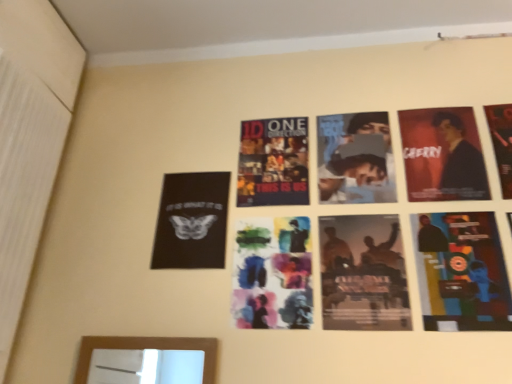
Question: Is point (240, 274) closer or farther from the camera than point (467, 155)?

Choices:
 (A) closer
 (B) farther

Answer: (A)

Question: Considering the positions of watercolor paper poster at center, placed as the second poster when sorted from left to right, and matte black suit at upper right in the image, is watercolor paper poster at center, placed as the second poster when sorted from left to right, bigger or smaller than matte black suit at upper right?

Choices:
 (A) small
 (B) big

Answer: (B)

Question: Estimate the real-world distances between objects in this image. Which object is farther from the black matte poster at upper left, arranged as the first poster when viewed from the left?

Choices:
 (A) matte black suit at upper right
 (B) watercolor paper poster at center, placed as the second poster when sorted from left to right
 (C) multicolored paper collage at lower right, the fourth poster in the left-to-right sequence
 (D) silhouette paper poster at center, which is the 3th poster in left-to-right order
 (E) matte black poster at upper right, the 1th poster from the right

Answer: (E)

Question: Which object is positioned farthest from the multicolored paper collage at lower right, the fourth poster in the left-to-right sequence?

Choices:
 (A) black matte poster at upper left, the 5th poster viewed from the right
 (B) watercolor paper poster at center, which appears as the fourth poster when viewed from the right
 (C) matte black suit at upper right
 (D) silhouette paper poster at center, which is the 3th poster in left-to-right order
 (E) matte black poster at upper right, the 5th poster when ordered from left to right

Answer: (A)